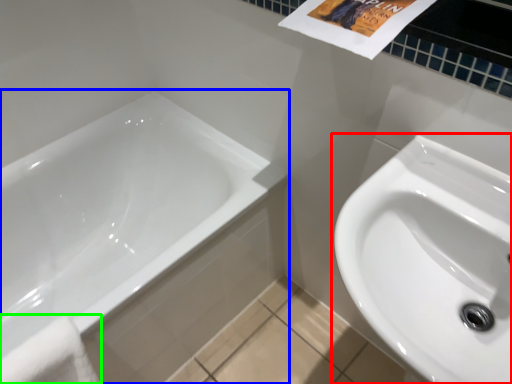
Question: Based on their relative distances, which object is farther from sink (highlighted by a red box)? Choose from bathtub (highlighted by a blue box) and bath towel (highlighted by a green box).

Choices:
 (A) bathtub
 (B) bath towel

Answer: (B)